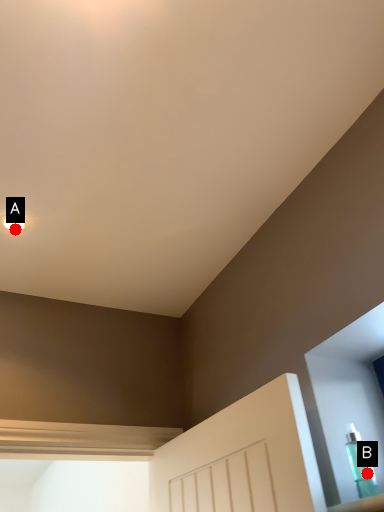
Question: Two points are circled on the image, labeled by A and B beside each circle. Which point is farther to the camera?

Choices:
 (A) A is further
 (B) B is further

Answer: (A)